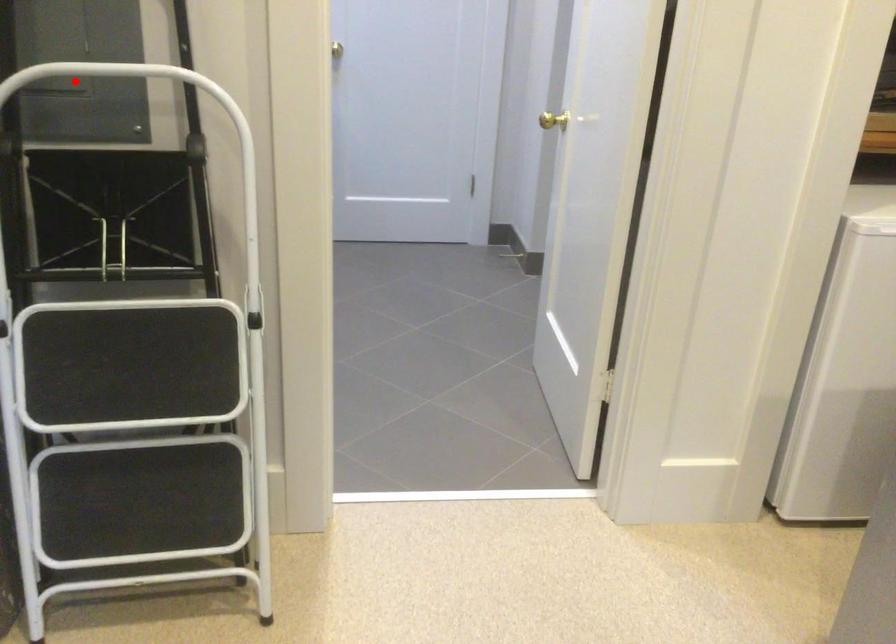
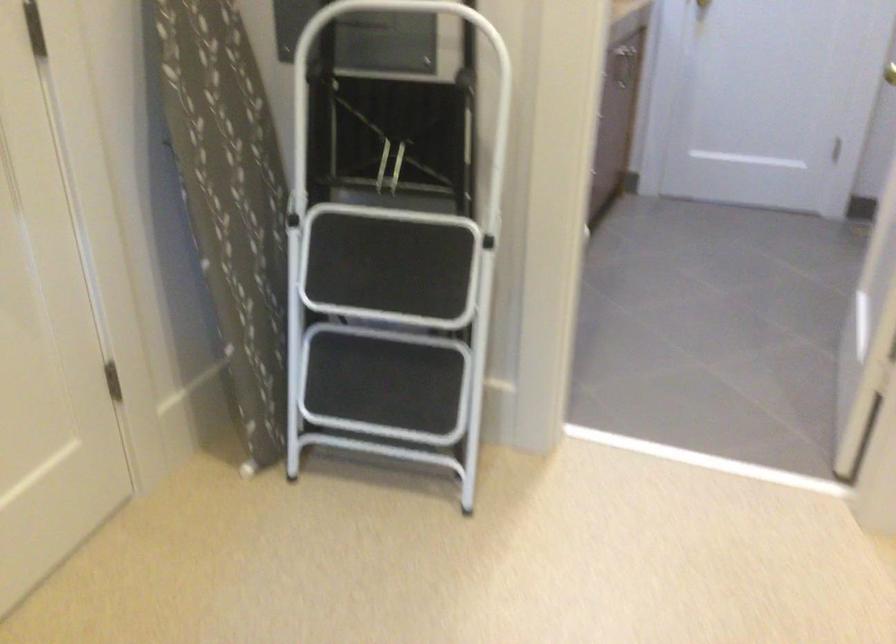
Where in the second image is the point corresponding to the highlighted location from the first image?

(378, 13)